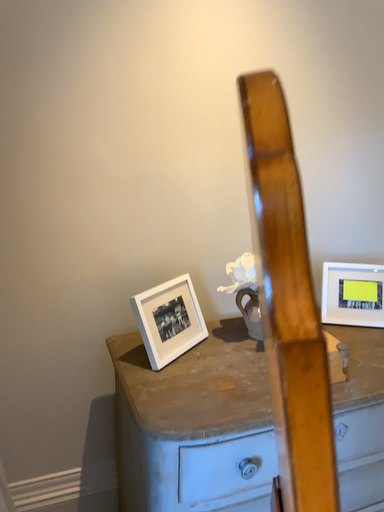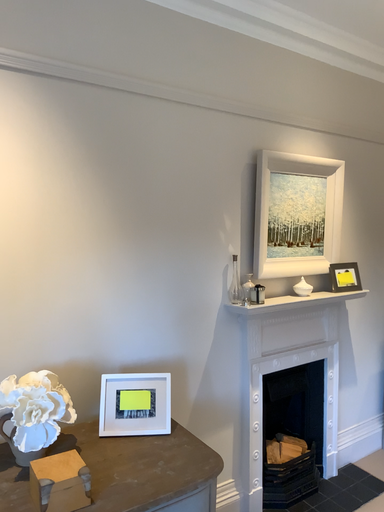
Question: Which way did the camera rotate in the video?

Choices:
 (A) rotated upward
 (B) rotated downward

Answer: (A)